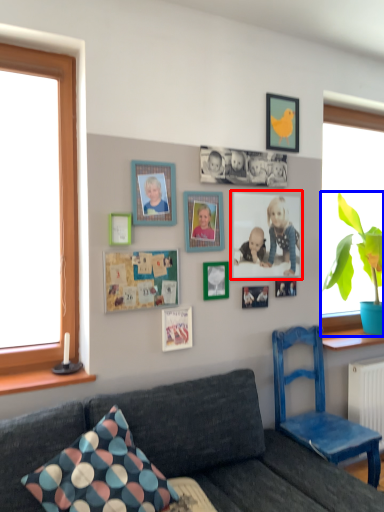
Question: Which object is further to the camera taking this photo, picture frame (highlighted by a red box) or houseplant (highlighted by a blue box)?

Choices:
 (A) picture frame
 (B) houseplant

Answer: (B)